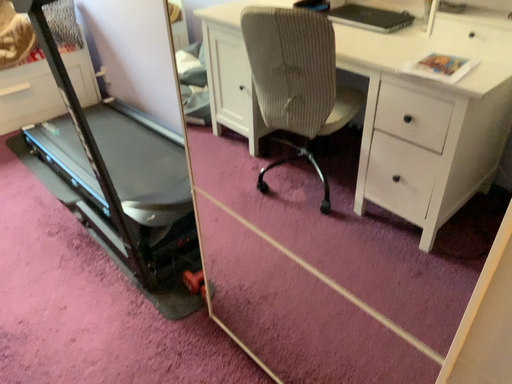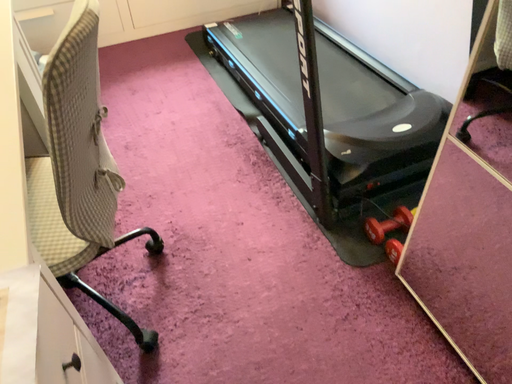
Question: Which way did the camera rotate in the video?

Choices:
 (A) rotated left
 (B) rotated right

Answer: (A)